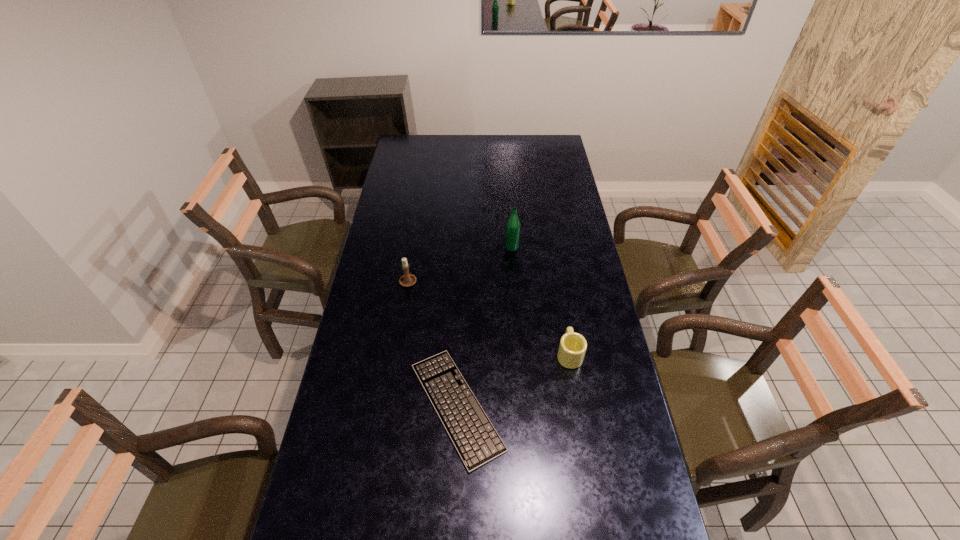
Identify the location of free region located on the side of the second tallest object with the handle. (419, 216).

The width and height of the screenshot is (960, 540). Find the location of `free spot located on the side of the second tallest object with the handle`. free spot located on the side of the second tallest object with the handle is located at coordinates (416, 233).

Locate an element on the screen. The height and width of the screenshot is (540, 960). free location located with the handle on the side of the second shortest object is located at coordinates (561, 301).

Identify the location of vacant region located with the handle on the side of the second shortest object. (561, 303).

Identify the location of vacant space positioned with the handle on the side of the second shortest object. [x=555, y=266].

I want to click on vacant space situated on the front of the computer keyboard, so click(452, 531).

Where is `object that is at the left edge`? This screenshot has width=960, height=540. object that is at the left edge is located at coordinates (406, 280).

The height and width of the screenshot is (540, 960). What are the coordinates of `object at the right edge` in the screenshot? It's located at (572, 348).

At what (x,y) coordinates should I click in order to perform the action: click on free location at the far edge of the desktop. Please return your answer as a coordinate pair (x, y). The image size is (960, 540). Looking at the image, I should click on (451, 154).

The width and height of the screenshot is (960, 540). I want to click on vacant area at the left edge, so click(x=394, y=235).